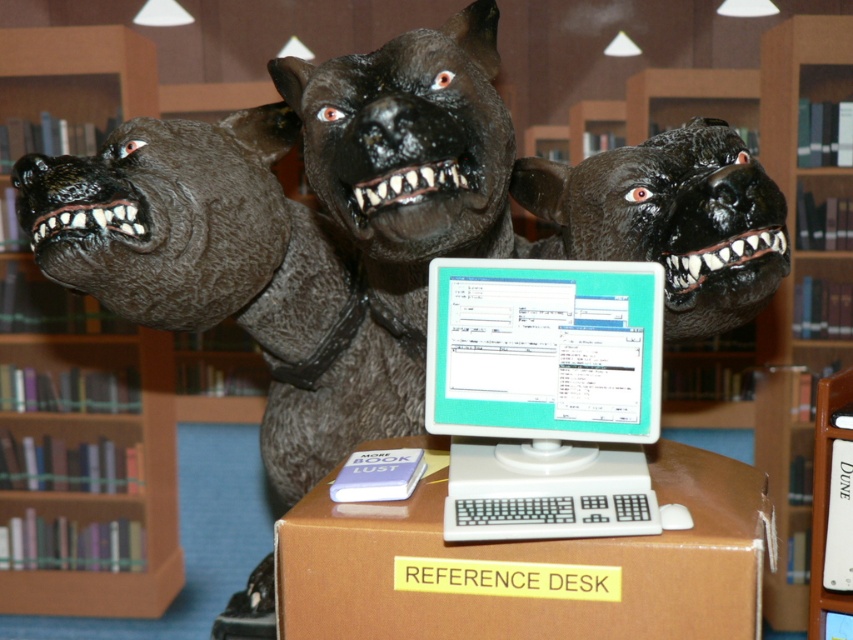
Question: Which object appears closest to the camera in this image?

Choices:
 (A) white plastic monitor at center
 (B) brown wooden bookshelf at upper center
 (C) wooden bookshelf at left

Answer: (A)

Question: Which of the following is the farthest from the observer?

Choices:
 (A) black rubber dog head at center
 (B) brown cardboard box at center

Answer: (A)

Question: Is brown cardboard box at center smaller than wooden bookshelf at left?

Choices:
 (A) yes
 (B) no

Answer: (B)

Question: Which object is the closest to the black rubber dog head at center?

Choices:
 (A) wooden bookshelf at left
 (B) brown wooden bookshelf at upper center
 (C) white plastic monitor at center
 (D) brown cardboard box at center

Answer: (C)

Question: In this image, where is white plastic monitor at center located relative to brown wooden bookshelf at upper center?

Choices:
 (A) above
 (B) below

Answer: (B)

Question: Is white plastic monitor at center to the right of wooden bookshelf at left from the viewer's perspective?

Choices:
 (A) no
 (B) yes

Answer: (B)